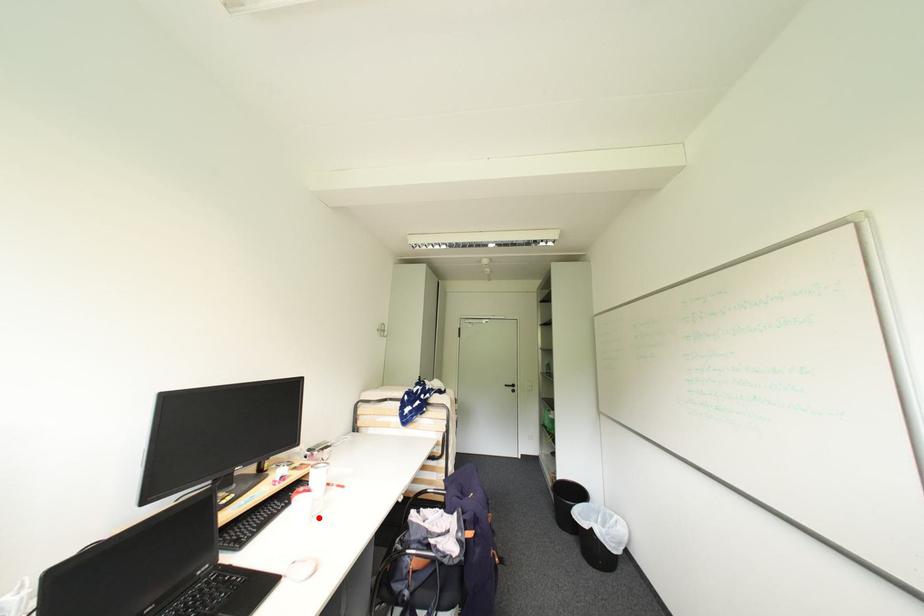
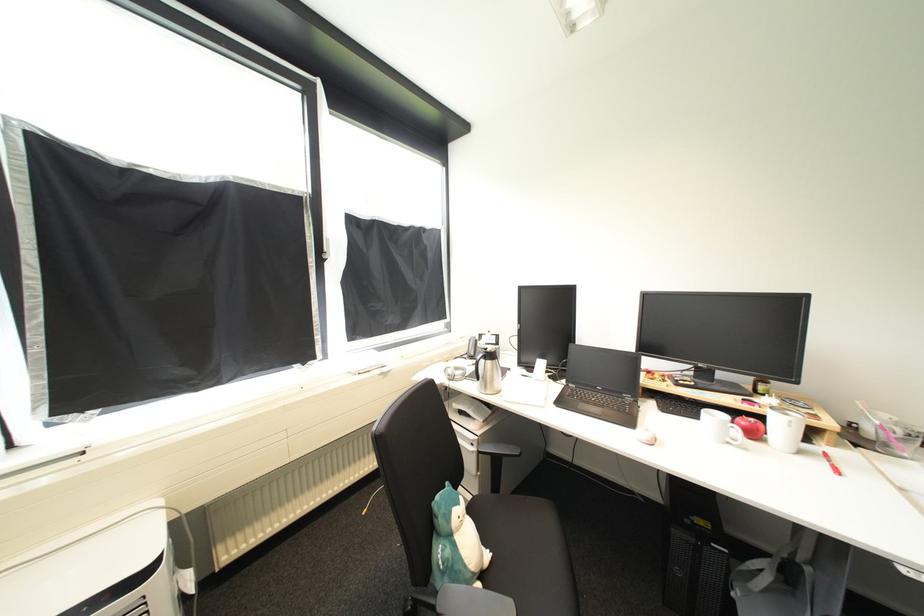
Question: I am providing you with two images of the same scene from different viewpoints. A red point is marked on the first image. At the location where the point appears in image 1, is it still visible in image 2?

Choices:
 (A) Yes
 (B) No

Answer: (A)